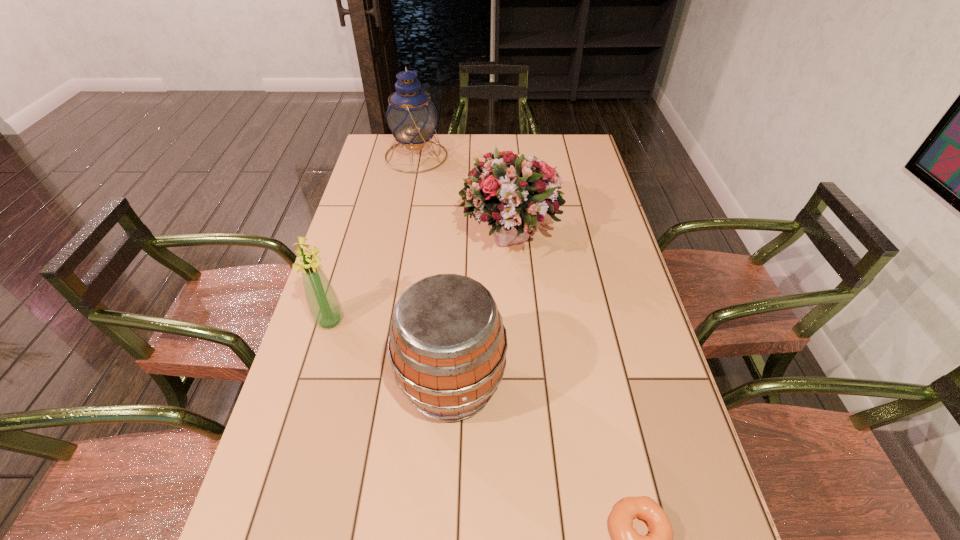
The height and width of the screenshot is (540, 960). I want to click on free spot between the third farthest object and the right bouquet, so click(x=420, y=280).

What are the coordinates of `free space between the right bouquet and the left bouquet` in the screenshot? It's located at (420, 280).

Where is `blank region between the right bouquet and the third nearest object`? The width and height of the screenshot is (960, 540). blank region between the right bouquet and the third nearest object is located at coordinates (420, 280).

Identify which object is the second closest to the left bouquet. Please provide its 2D coordinates. Your answer should be formatted as a tuple, i.e. [(x, y)], where the tuple contains the x and y coordinates of a point satisfying the conditions above.

[(515, 191)]

Locate which object is the second closest to the shortest object. Please provide its 2D coordinates. Your answer should be formatted as a tuple, i.e. [(x, y)], where the tuple contains the x and y coordinates of a point satisfying the conditions above.

[(515, 191)]

Locate an element on the screen. The height and width of the screenshot is (540, 960). free location that satisfies the following two spatial constraints: 1. on the front-facing side of the fourth farthest object; 2. on the right side of the third nearest object is located at coordinates tap(311, 384).

The image size is (960, 540). I want to click on vacant region that satisfies the following two spatial constraints: 1. on the front-facing side of the lantern; 2. on the front-facing side of the left bouquet, so click(385, 321).

In order to click on free space that satisfies the following two spatial constraints: 1. on the front-facing side of the second farthest object; 2. on the left side of the tallest object in this screenshot , I will do `click(400, 239)`.

This screenshot has width=960, height=540. I want to click on free space in the image that satisfies the following two spatial constraints: 1. on the front-facing side of the fourth farthest object; 2. on the left side of the left bouquet, so click(x=311, y=384).

This screenshot has height=540, width=960. In order to click on vacant area that satisfies the following two spatial constraints: 1. on the front-facing side of the nearer bouquet; 2. on the right side of the second nearest object in this screenshot , I will do `click(311, 384)`.